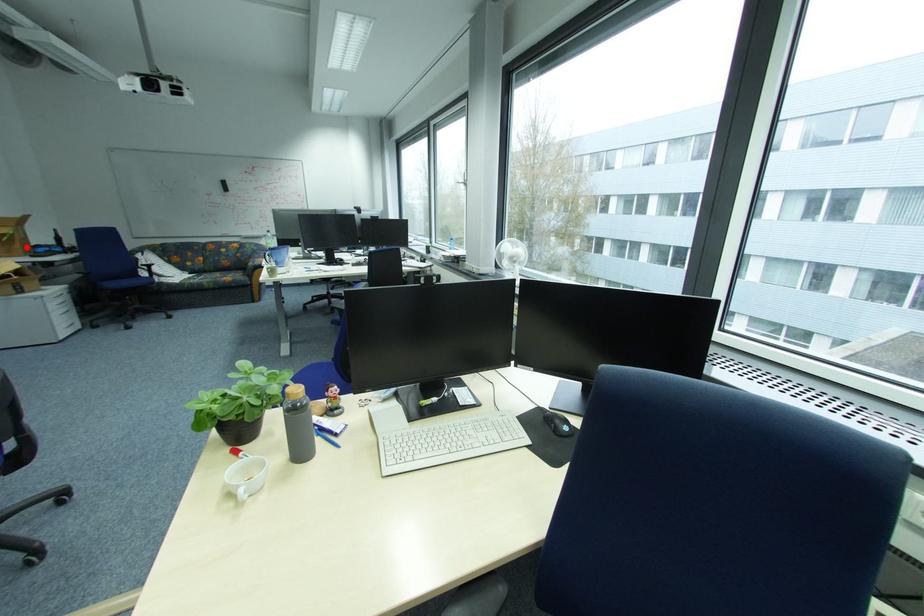
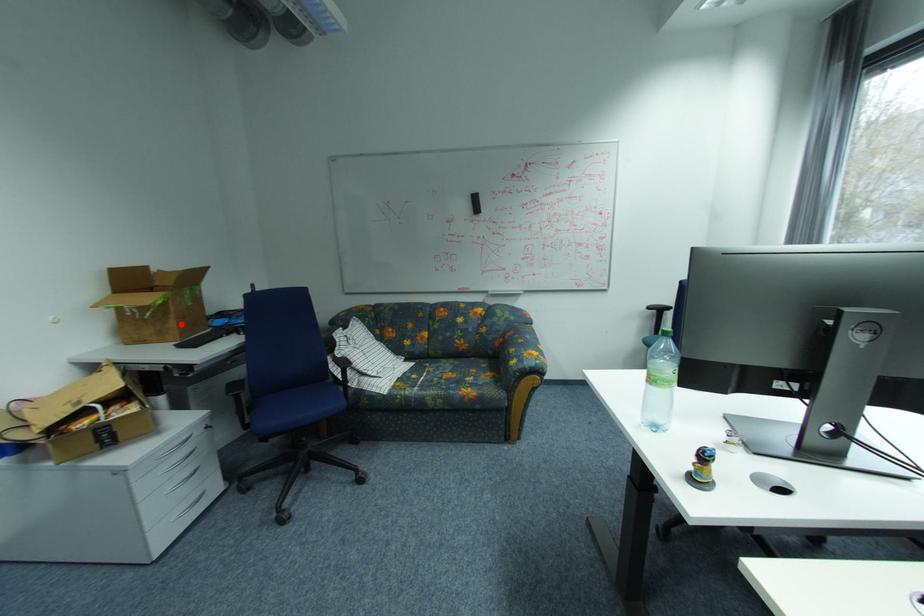
I am providing you with two images of the same scene from different viewpoints. A red point is marked on the first image and another point is marked on the second image. Is the marked point in image1 the same physical position as the marked point in image2?

Yes